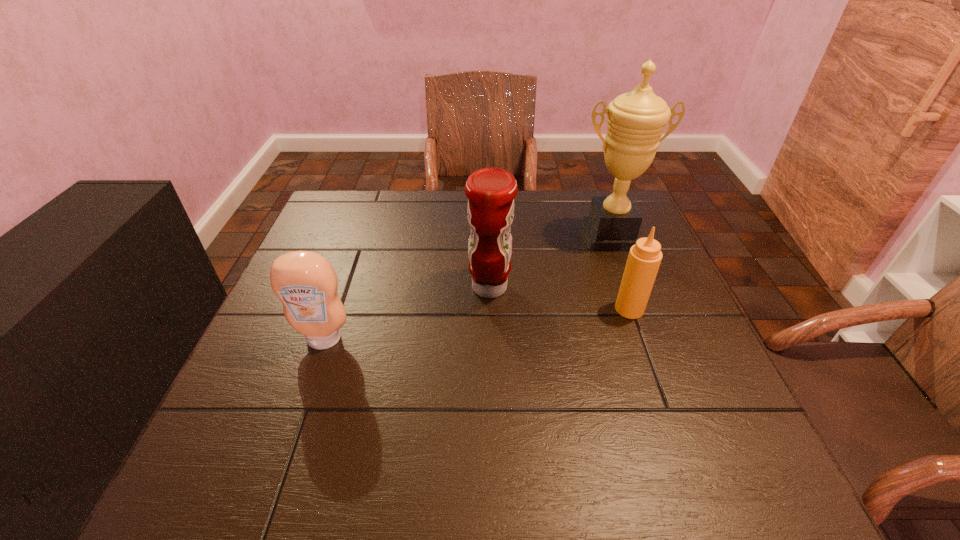
I want to click on vacant point located between the second condiment from right to left and the farthest object, so click(x=549, y=262).

Locate an element on the screen. The image size is (960, 540). free space between the second condiment from left to right and the trophy cup is located at coordinates (549, 262).

Locate which object is the closest to the rightmost condiment. Please provide its 2D coordinates. Your answer should be formatted as a tuple, i.e. [(x, y)], where the tuple contains the x and y coordinates of a point satisfying the conditions above.

[(636, 120)]

Select which object is the second closest to the farthest object. Please provide its 2D coordinates. Your answer should be formatted as a tuple, i.e. [(x, y)], where the tuple contains the x and y coordinates of a point satisfying the conditions above.

[(491, 191)]

Image resolution: width=960 pixels, height=540 pixels. I want to click on condiment that is the second closest to the rightmost condiment, so click(305, 282).

The width and height of the screenshot is (960, 540). I want to click on condiment that is the third closest to the tallest object, so click(x=305, y=282).

Where is `vacant region that satisfies the following two spatial constraints: 1. on the front side of the rightmost condiment; 2. on the left side of the second condiment from left to right`? This screenshot has width=960, height=540. vacant region that satisfies the following two spatial constraints: 1. on the front side of the rightmost condiment; 2. on the left side of the second condiment from left to right is located at coordinates (490, 309).